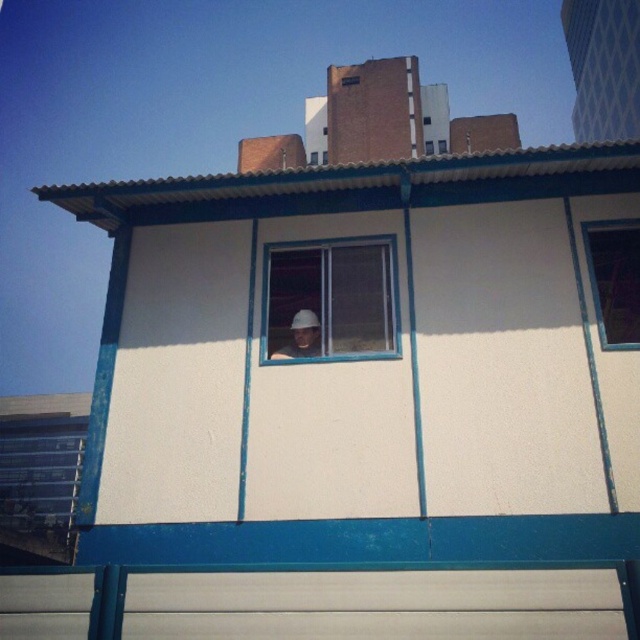
You are an architect designing a new building and want to ensure proper ventilation. You have two windows to consider in your design. Based on the image, which window between the transparent plastic window at center and the transparent glass window at upper right is taller and thus might allow more airflow?

The transparent plastic window at center is taller than the transparent glass window at upper right, so it might allow more airflow.

You are standing at the point marked as point (x=330, y=300) in the image. What object is located exactly at that point?

The transparent plastic window at center is located exactly at point (x=330, y=300).